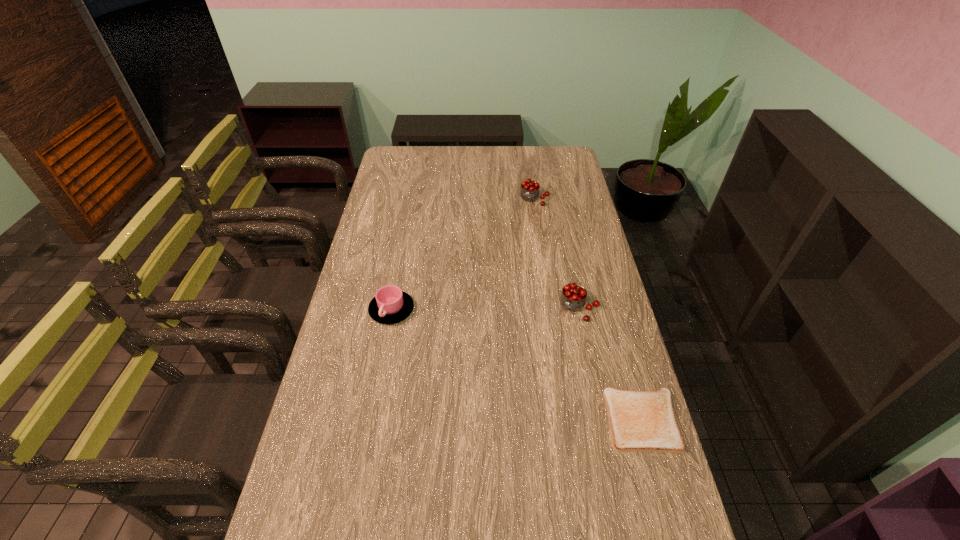
The width and height of the screenshot is (960, 540). I want to click on the leftmost object, so click(x=390, y=305).

Find the location of a particular element. This screenshot has width=960, height=540. cup is located at coordinates 390,305.

This screenshot has width=960, height=540. In order to click on the nearest object in this screenshot , I will do `click(640, 421)`.

Image resolution: width=960 pixels, height=540 pixels. I want to click on the shortest object, so click(x=640, y=421).

This screenshot has width=960, height=540. Identify the location of the nearer pot filled with cherries. (573, 298).

Where is `the farthest object`? the farthest object is located at coordinates (529, 192).

Where is `vacant space situated 0.370m on the side with the handle of the cup`? Image resolution: width=960 pixels, height=540 pixels. vacant space situated 0.370m on the side with the handle of the cup is located at coordinates (368, 441).

This screenshot has width=960, height=540. What are the coordinates of `vacant region located on the front of the shortest object` in the screenshot? It's located at (663, 495).

This screenshot has width=960, height=540. I want to click on vacant point located on the handle side of the nearer pot filled with cherries, so click(562, 332).

The image size is (960, 540). I want to click on vacant space located on the handle side of the nearer pot filled with cherries, so click(x=533, y=382).